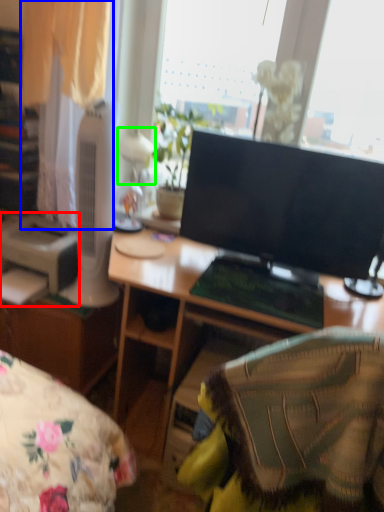
Question: Which object is positioned closest to printer (highlighted by a red box)? Select from curtain (highlighted by a blue box) and table lamp (highlighted by a green box).

Choices:
 (A) curtain
 (B) table lamp

Answer: (A)